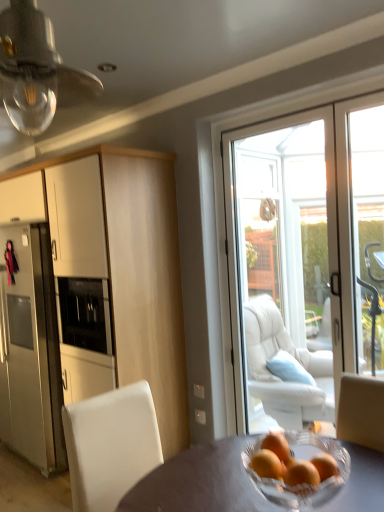
Question: From the image's perspective, relative to matte white cabinet at left, is clear glass bulb at upper left above or below?

Choices:
 (A) above
 (B) below

Answer: (A)

Question: Considering the positions of point (31, 56) and point (153, 372), is point (31, 56) closer or farther from the camera than point (153, 372)?

Choices:
 (A) closer
 (B) farther

Answer: (A)

Question: Which object is positioned farthest from the clear glass bulb at upper left?

Choices:
 (A) white leather chair at lower left
 (B) white glass door at center
 (C) matte white cabinet at left
 (D) transparent glass door at right
 (E) orange matte at center

Answer: (D)

Question: Which object is positioned farthest from the orange matte at center?

Choices:
 (A) white glass door at center
 (B) matte white cabinet at left
 (C) clear glass bulb at upper left
 (D) matte gray table at center
 (E) white leather chair at lower left

Answer: (C)